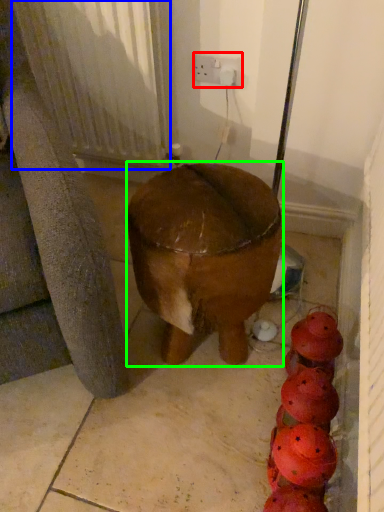
Question: Considering the real-world distances, which object is closest to electric outlet (highlighted by a red box)? radiator (highlighted by a blue box) or furniture (highlighted by a green box).

Choices:
 (A) radiator
 (B) furniture

Answer: (A)